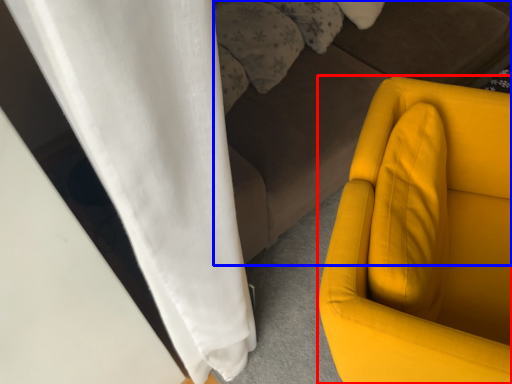
Question: Among these objects, which one is farthest to the camera, furniture (highlighted by a red box) or studio couch (highlighted by a blue box)?

Choices:
 (A) furniture
 (B) studio couch

Answer: (B)